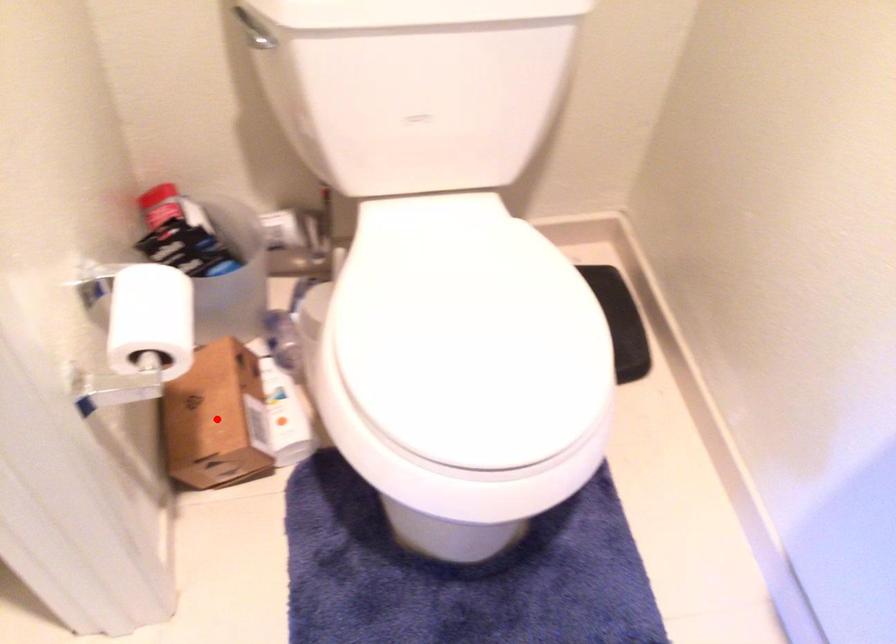
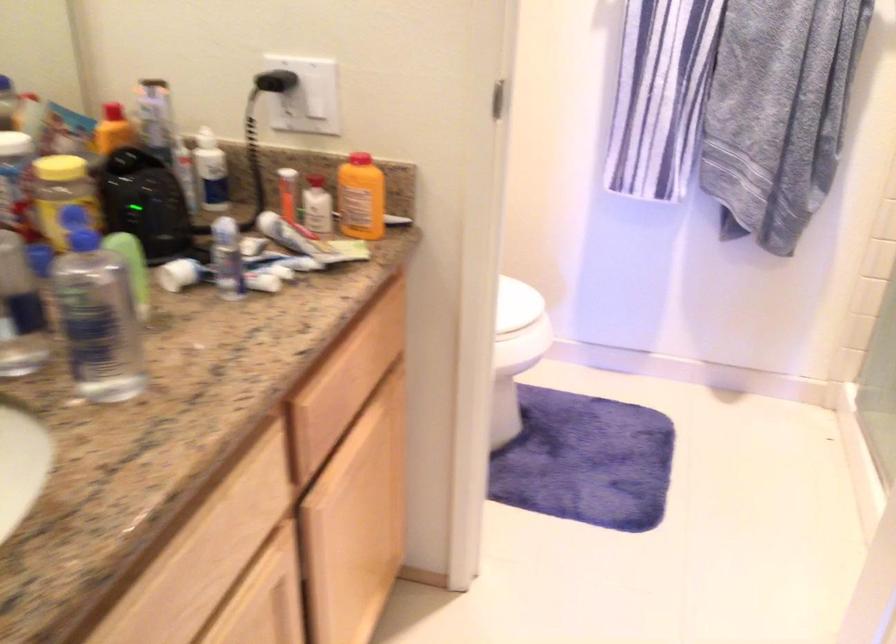
Question: I am providing you with two images of the same scene from different viewpoints. A red point is marked on the first image. At the location where the point appears in image 1, is it still visible in image 2?

Choices:
 (A) Yes
 (B) No

Answer: (B)